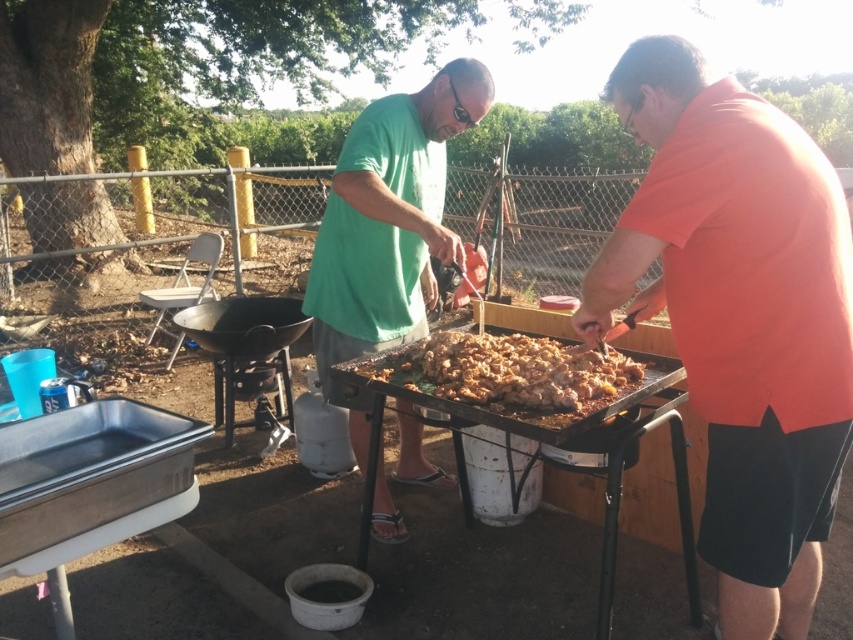
Where is the orange matte shirt at center located in the image?

The orange matte shirt at center is located at point 0.497 on the x axis and 0.869 on the y axis.